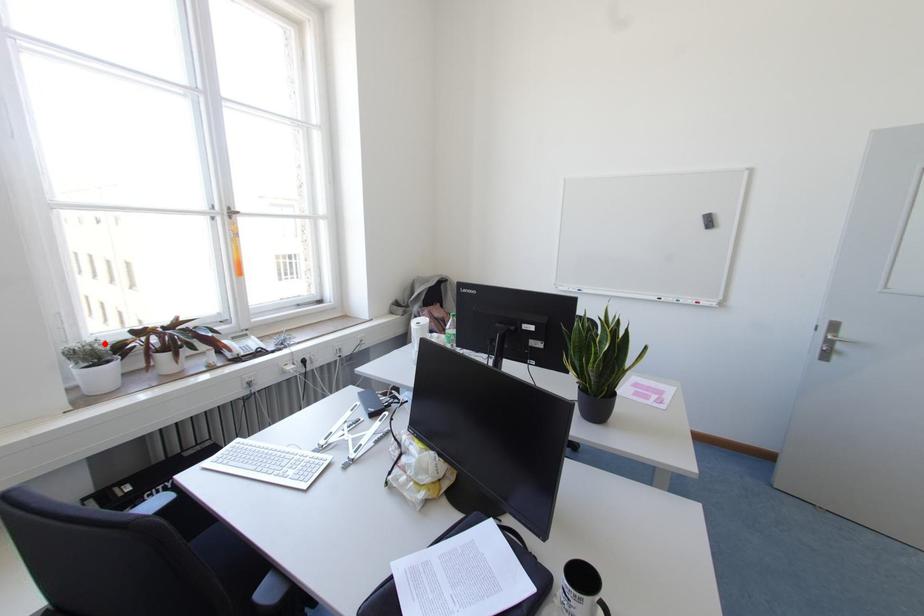
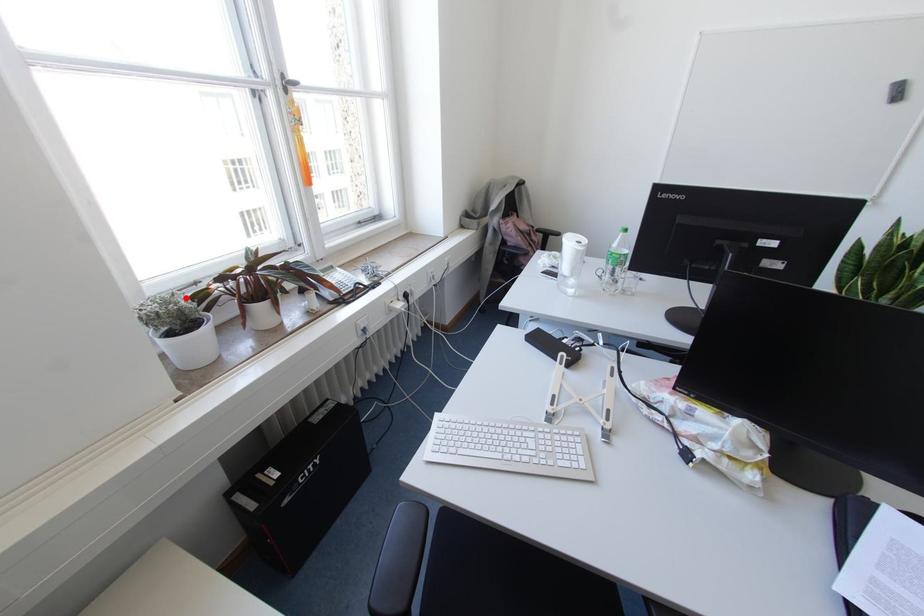
I am providing you with two images of the same scene from different viewpoints. A red point is marked on the first image and another point is marked on the second image. Does the point marked in image1 correspond to the same location as the one in image2?

Yes